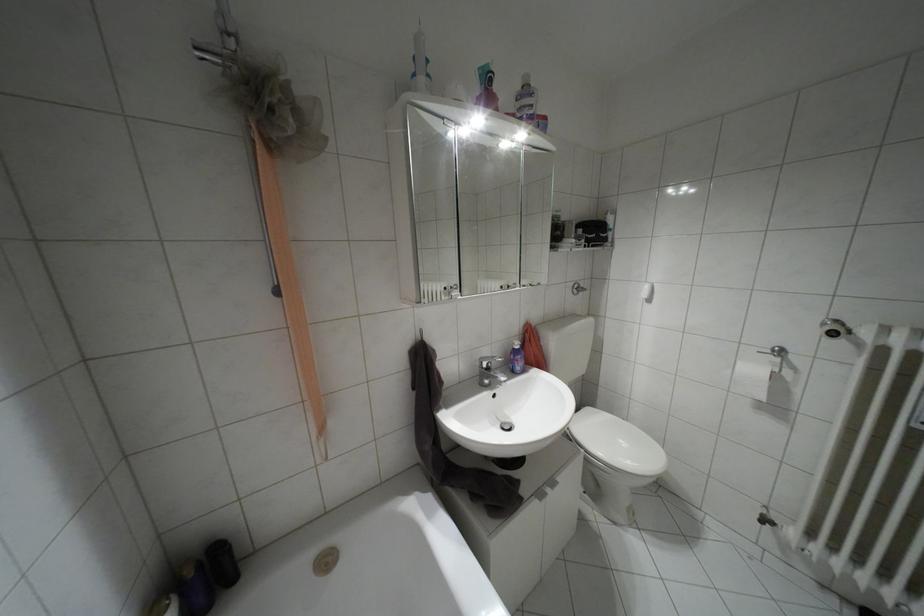
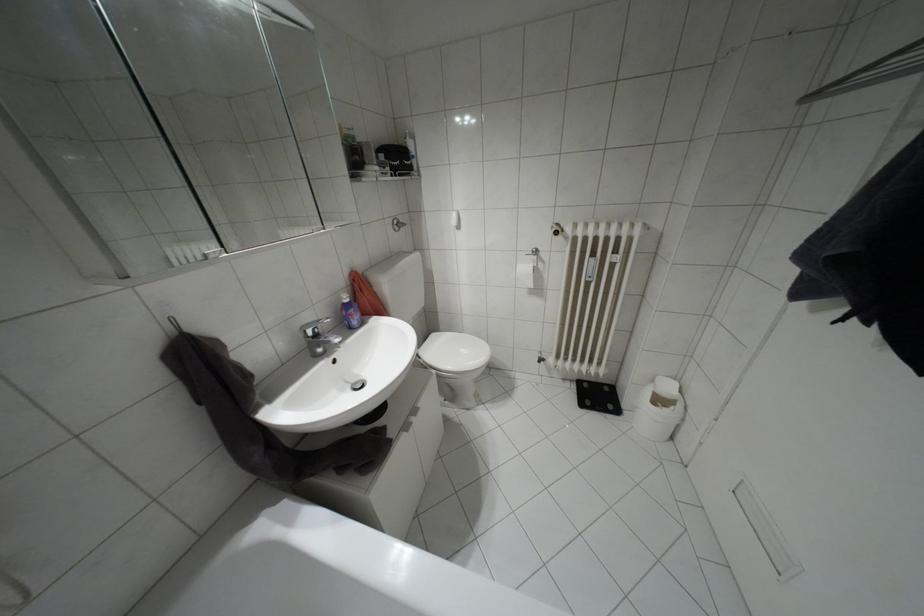
The point at (588, 408) is marked in the first image. Where is the corresponding point in the second image?

(432, 334)